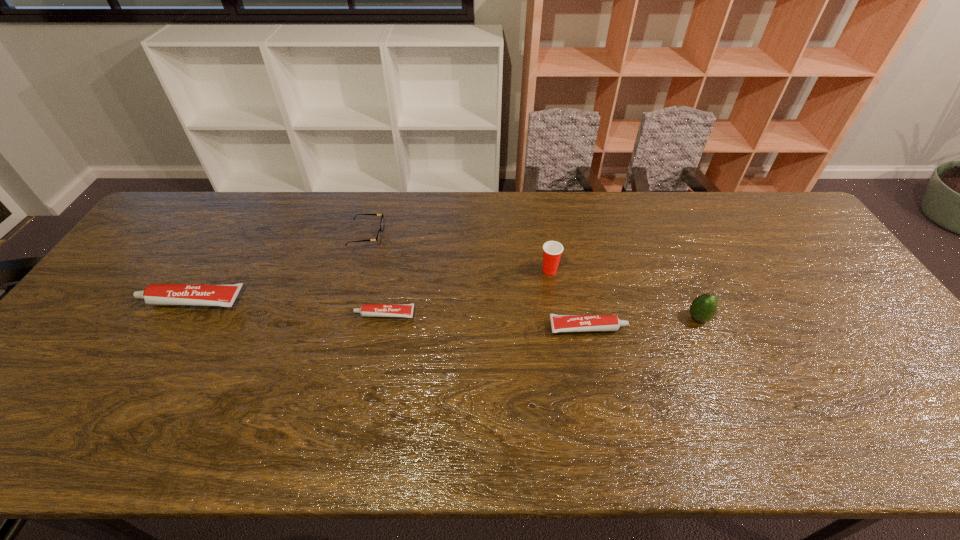
Locate an element on the screen. The image size is (960, 540). free space at the left edge of the desktop is located at coordinates (109, 313).

What are the coordinates of `vacant space at the near left corner of the desktop` in the screenshot? It's located at (19, 402).

The image size is (960, 540). Find the location of `vacant region at the far right corner of the desktop`. vacant region at the far right corner of the desktop is located at coordinates (743, 200).

What are the coordinates of `free space at the near right corner of the desktop` in the screenshot? It's located at (915, 391).

Locate an element on the screen. The image size is (960, 540). free space between the second shortest toothpaste and the farthest object is located at coordinates (477, 282).

Where is `free space between the second toothpaste from left to right and the second farthest object`? The image size is (960, 540). free space between the second toothpaste from left to right and the second farthest object is located at coordinates (467, 292).

Find the location of a particular element. The height and width of the screenshot is (540, 960). vacant area that lies between the fourth shortest object and the rightmost object is located at coordinates (444, 310).

Locate an element on the screen. free area in between the rightmost object and the second toothpaste from left to right is located at coordinates (541, 316).

Find the location of a particular element. This screenshot has height=540, width=960. empty space that is in between the shortest toothpaste and the tallest toothpaste is located at coordinates (288, 308).

I want to click on vacant area that lies between the tallest toothpaste and the spectacles, so click(278, 269).